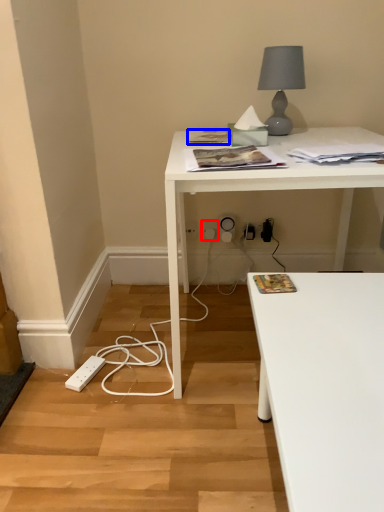
Question: Which point is closer to the camera, electric outlet (highlighted by a red box) or magazine (highlighted by a blue box)?

Choices:
 (A) electric outlet
 (B) magazine

Answer: (B)